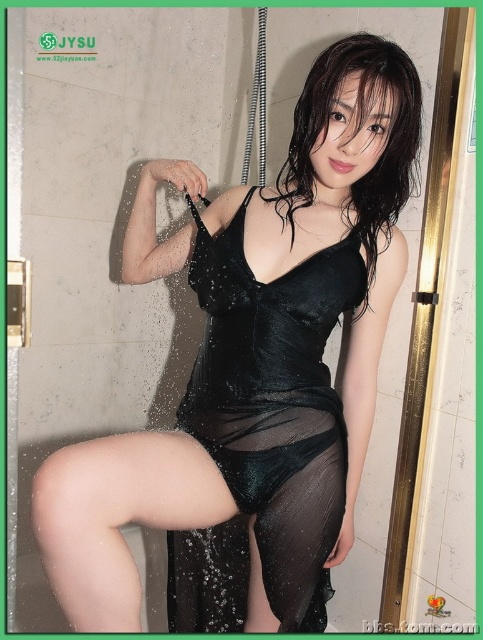
Is black sheer dress at center above black sheer skirt at lower center?

Result: Yes, black sheer dress at center is above black sheer skirt at lower center.

Which is in front, point (235, 403) or point (317, 534)?

Point (235, 403) is in front.

This screenshot has height=640, width=483. In order to click on black sheer dress at center in this screenshot , I will do `click(265, 433)`.

Find the location of `black sheer dress at center`. black sheer dress at center is located at coordinates (265, 433).

Does black sheer skirt at lower center have a greater width compared to satin black dress at center?

Indeed, black sheer skirt at lower center has a greater width compared to satin black dress at center.

Can you confirm if black sheer skirt at lower center is positioned to the right of satin black dress at center?

In fact, black sheer skirt at lower center is to the left of satin black dress at center.

Describe the element at coordinates (263, 512) in the screenshot. I see `black sheer skirt at lower center` at that location.

Find the location of a particular element. This screenshot has height=640, width=483. black sheer skirt at lower center is located at coordinates (263, 512).

Can you confirm if black sheer dress at center is wider than satin black dress at center?

Yes, black sheer dress at center is wider than satin black dress at center.

Is black sheer dress at center to the left of satin black dress at center from the viewer's perspective?

Indeed, black sheer dress at center is positioned on the left side of satin black dress at center.

Is point (213, 397) positioned after point (300, 93)?

No, it is not.

At what (x,y) coordinates should I click in order to perform the action: click on black sheer dress at center. Please return your answer as a coordinate pair (x, y). This screenshot has height=640, width=483. Looking at the image, I should click on (265, 433).